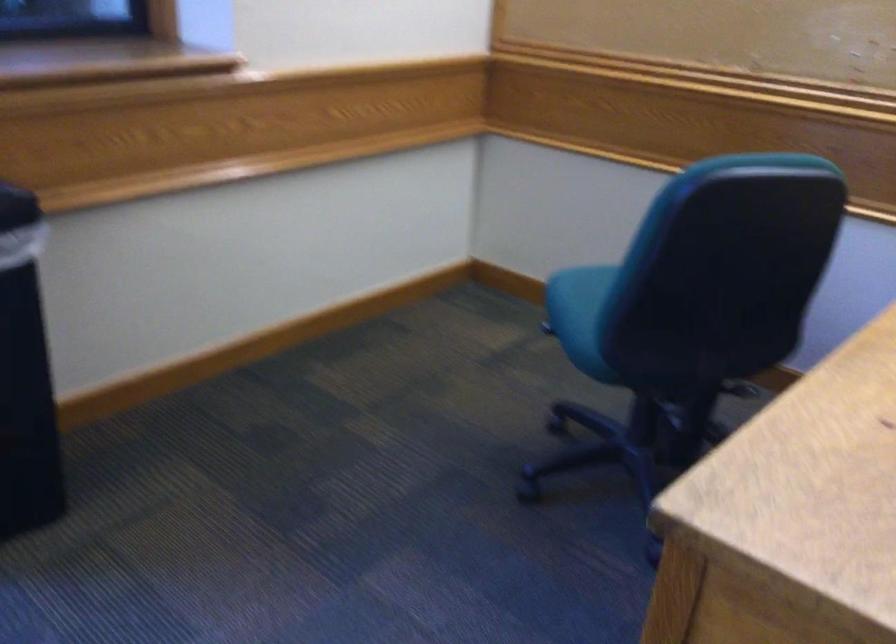
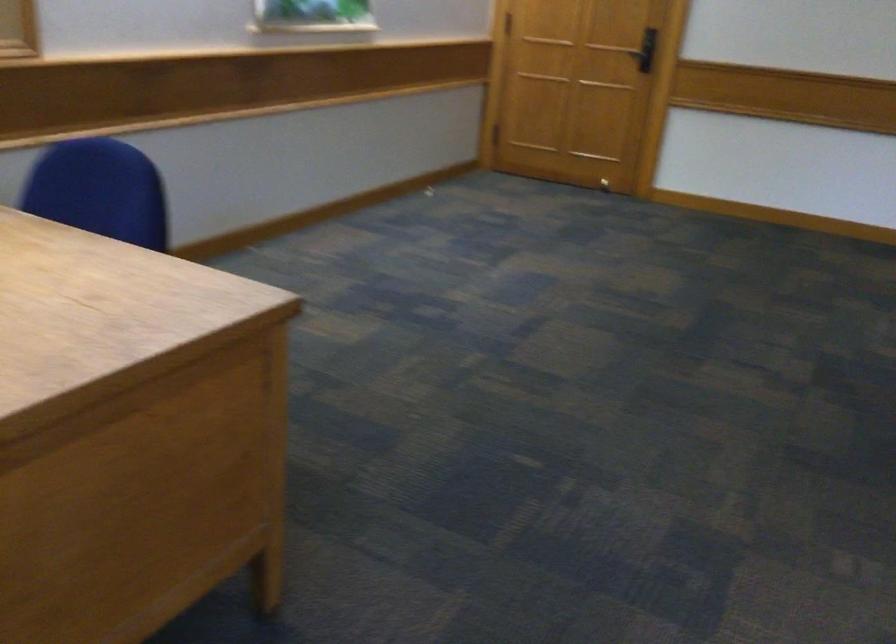
Based on the continuous images, in which direction is the camera rotating?

The rotation direction of the camera is right-down.